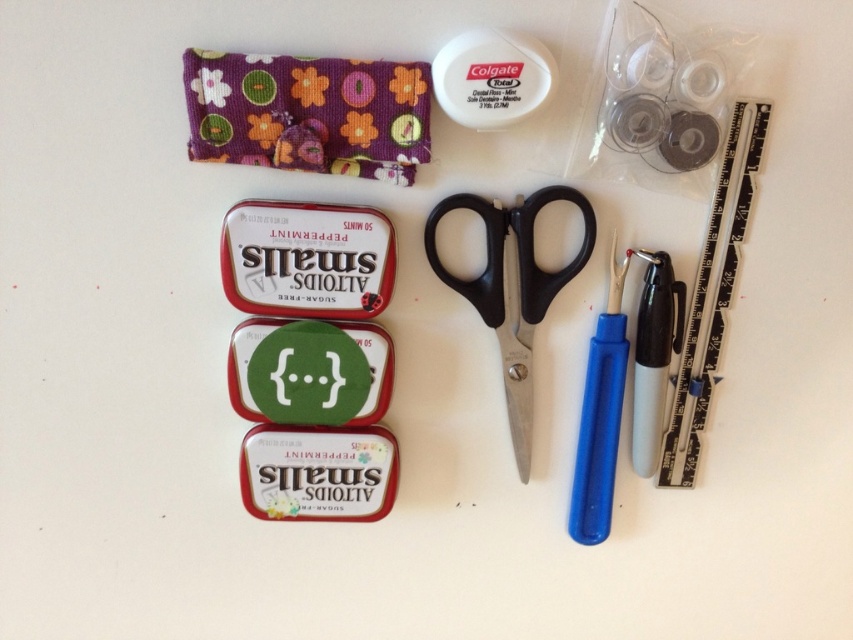
Question: Observing the image, what is the correct spatial positioning of black plastic scissors at center in reference to black plastic ruler at upper right?

Choices:
 (A) left
 (B) right

Answer: (A)

Question: Where is black plastic scissors at center located in relation to black plastic ruler at upper right in the image?

Choices:
 (A) below
 (B) above

Answer: (A)

Question: Is black plastic ruler at upper right thinner than blue plastic needle at right?

Choices:
 (A) yes
 (B) no

Answer: (B)

Question: Which point appears farthest from the camera in this image?

Choices:
 (A) pos(605,472)
 (B) pos(486,312)
 (C) pos(711,362)

Answer: (A)

Question: Which is farther from the blue plastic needle at right?

Choices:
 (A) black plastic scissors at center
 (B) black plastic ruler at upper right

Answer: (B)

Question: Which object is the farthest from the black plastic ruler at upper right?

Choices:
 (A) black plastic scissors at center
 (B) blue plastic needle at right

Answer: (A)